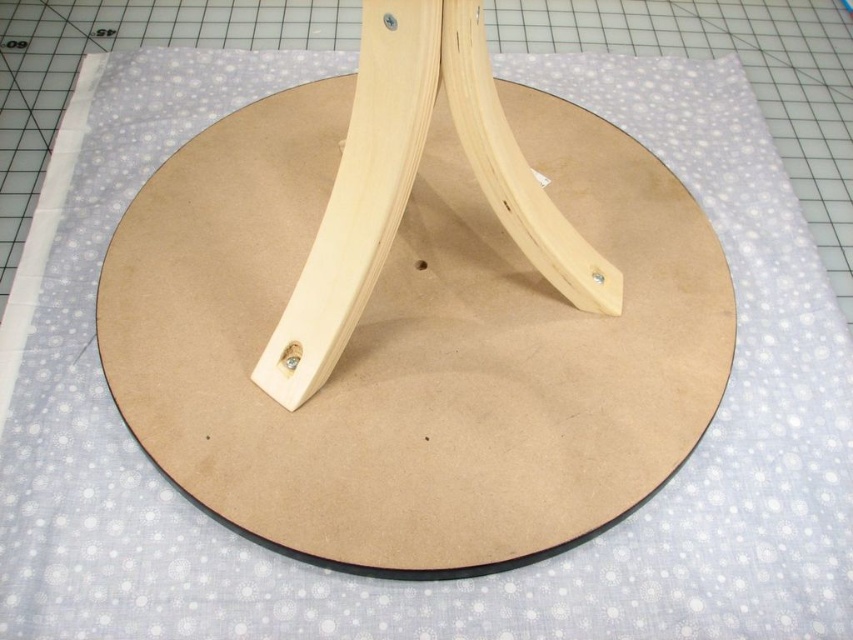
Between natural wood round base at center and natural wood tripod at center, which one has less height?

natural wood tripod at center

Can you confirm if natural wood round base at center is positioned above natural wood tripod at center?

No.

I want to click on natural wood round base at center, so click(x=415, y=342).

This screenshot has height=640, width=853. Identify the location of natural wood round base at center. (415, 342).